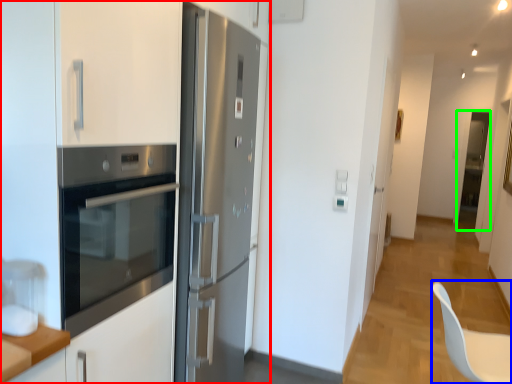
Question: Which is nearer to the cabinetry (highlighted by a red box)? swivel chair (highlighted by a blue box) or glass door (highlighted by a green box).

Choices:
 (A) swivel chair
 (B) glass door

Answer: (A)